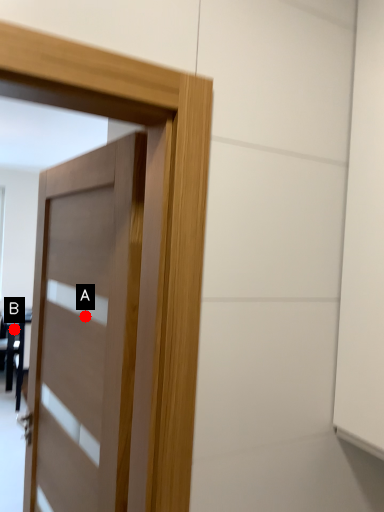
Question: Two points are circled on the image, labeled by A and B beside each circle. Which of the following is the farthest from the observer?

Choices:
 (A) A is further
 (B) B is further

Answer: (B)